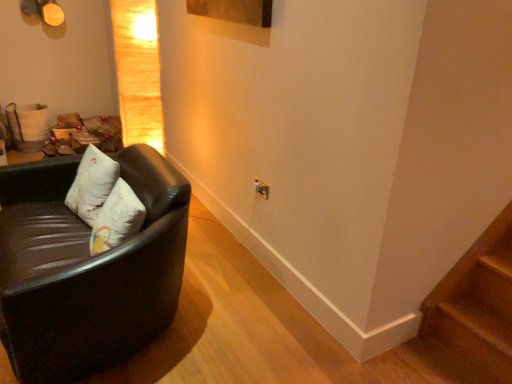
You are a GUI agent. You are given a task and a screenshot of the screen. Output one action in this format:
    pyautogui.click(x=<x>, y=<y>)
    Task: Click on the black leather couch at left
    This screenshot has height=384, width=512.
    Given the screenshot: What is the action you would take?
    pyautogui.click(x=86, y=269)

Find the location of a particular element. This screenshot has height=384, width=512. black leather couch at left is located at coordinates (86, 269).

Is matte gold lampshade at upper left completely or partially outside of wooden at lower right?

Absolutely, matte gold lampshade at upper left is external to wooden at lower right.

From a real-world perspective, does matte gold lampshade at upper left sit lower than wooden at lower right?

No, from a real-world perspective, matte gold lampshade at upper left is not under wooden at lower right.

Are matte gold lampshade at upper left and wooden at lower right making contact?

matte gold lampshade at upper left and wooden at lower right are clearly separated.

Could you tell me if matte gold lampshade at upper left is turned towards wooden at lower right?

No, matte gold lampshade at upper left is not aimed at wooden at lower right.

Is matte gold lampshade at upper left inside black leather couch at left?

Actually, matte gold lampshade at upper left is outside black leather couch at left.

Based on the photo, from the image's perspective, is black leather couch at left located above matte gold lampshade at upper left?

No, from the image's perspective, black leather couch at left is not over matte gold lampshade at upper left.

In terms of size, does black leather couch at left appear bigger or smaller than matte gold lampshade at upper left?

Considering their sizes, black leather couch at left takes up more space than matte gold lampshade at upper left.

Are black leather couch at left and matte gold lampshade at upper left far apart?

That's not correct — black leather couch at left is a little close to matte gold lampshade at upper left.

In the scene shown: Is white soft pillow at left spatially inside black leather couch at left, or outside of it?

white soft pillow at left exists entirely within black leather couch at left.

Is white soft pillow at left positioned with its back to black leather couch at left?

Yes, white soft pillow at left's orientation is away from black leather couch at left.

Which point is more distant from viewer, (93, 187) or (109, 325)?

The point (93, 187) is farther.

Which is more to the right, white soft pillow at left or black leather couch at left?

Positioned to the right is black leather couch at left.

How far apart are matte gold lampshade at upper left and white soft pillow at left?

matte gold lampshade at upper left is 24.65 inches from white soft pillow at left.

Which is behind, matte gold lampshade at upper left or white soft pillow at left?

Positioned behind is matte gold lampshade at upper left.

Is matte gold lampshade at upper left not within white soft pillow at left?

Yes.

Is wooden at lower right inside or outside of black leather couch at left?

wooden at lower right is not enclosed by black leather couch at left.

Between point (475, 381) and point (29, 209), which one is positioned behind?

Point (29, 209)

Considering the sizes of wooden at lower right and black leather couch at left in the image, is wooden at lower right taller or shorter than black leather couch at left?

Clearly, wooden at lower right is shorter compared to black leather couch at left.

Who is shorter, white soft pillow at left or wooden at lower right?

wooden at lower right is shorter.

Would you say white soft pillow at left is a long distance from wooden at lower right?

Absolutely, white soft pillow at left is distant from wooden at lower right.

Locate an element on the screen. The height and width of the screenshot is (384, 512). pillow that is on the left side of wooden at lower right is located at coordinates (92, 184).

Based on their sizes in the image, would you say white soft pillow at left is bigger or smaller than wooden at lower right?

Considering their sizes, white soft pillow at left takes up more space than wooden at lower right.

Is wooden at lower right next to matte gold lampshade at upper left?

No, wooden at lower right is not with matte gold lampshade at upper left.

Who is smaller, wooden at lower right or matte gold lampshade at upper left?

With smaller size is wooden at lower right.

Does wooden at lower right turn towards matte gold lampshade at upper left?

No.

Find the location of a particular element. This screenshot has width=512, height=384. lamp that appears above the wooden at lower right (from a real-world perspective) is located at coordinates (138, 72).

Locate an element on the screen. Image resolution: width=512 pixels, height=384 pixels. lamp above the black leather couch at left (from the image's perspective) is located at coordinates (138, 72).

From the image, which object appears to be nearer to matte gold lampshade at upper left, white soft pillow at left or wooden at lower right?

Among the two, white soft pillow at left is located nearer to matte gold lampshade at upper left.

In the scene shown: Which object lies further to the anchor point wooden at lower right, matte gold lampshade at upper left or black leather couch at left?

matte gold lampshade at upper left.

Based on their spatial positions, is matte gold lampshade at upper left or white soft pillow at left further from wooden at lower right?

The object further to wooden at lower right is matte gold lampshade at upper left.

Considering their positions, is matte gold lampshade at upper left positioned closer to black leather couch at left than white soft pillow at left?

Among the two, white soft pillow at left is located nearer to black leather couch at left.

When comparing their distances from white soft pillow at left, does matte gold lampshade at upper left or black leather couch at left seem closer?

black leather couch at left lies closer to white soft pillow at left than the other object.

Estimate the real-world distances between objects in this image. Which object is closer to matte gold lampshade at upper left, wooden at lower right or black leather couch at left?

The object closer to matte gold lampshade at upper left is black leather couch at left.

Looking at the image, which one is located closer to wooden at lower right, black leather couch at left or white soft pillow at left?

Based on the image, black leather couch at left appears to be nearer to wooden at lower right.

From the image, which object appears to be farther from white soft pillow at left, black leather couch at left or wooden at lower right?

wooden at lower right is positioned further to the anchor white soft pillow at left.

Image resolution: width=512 pixels, height=384 pixels. I want to click on lamp between white soft pillow at left and wooden at lower right from left to right, so click(138, 72).

You are a GUI agent. You are given a task and a screenshot of the screen. Output one action in this format:
    pyautogui.click(x=<x>, y=<y>)
    Task: Click on the lamp between black leather couch at left and wooden at lower right
    
    Given the screenshot: What is the action you would take?
    pyautogui.click(x=138, y=72)

The width and height of the screenshot is (512, 384). Identify the location of studio couch between white soft pillow at left and wooden at lower right in the horizontal direction. (86, 269).

What are the coordinates of `pillow between black leather couch at left and matte gold lampshade at upper left along the z-axis` in the screenshot? It's located at (92, 184).